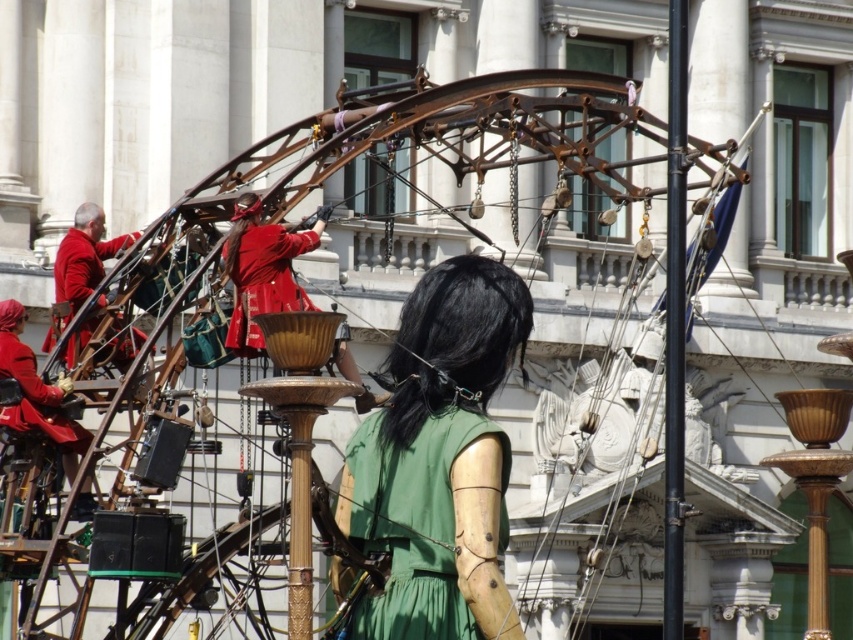
Question: Which of these objects is positioned farthest from the matte red coat at left?

Choices:
 (A) black metal pole at upper right
 (B) green matte dress at center

Answer: (A)

Question: Can you confirm if green matte dress at center is positioned below matte red coat at left?

Choices:
 (A) yes
 (B) no

Answer: (A)

Question: Which object is positioned closest to the green matte dress at center?

Choices:
 (A) black metal pole at upper right
 (B) matte red coat at left

Answer: (A)

Question: Among these objects, which one is farthest from the camera?

Choices:
 (A) matte red coat at left
 (B) black metal pole at upper right

Answer: (A)

Question: Can you confirm if black metal pole at upper right is bigger than matte red coat at left?

Choices:
 (A) no
 (B) yes

Answer: (B)

Question: Can you confirm if green matte dress at center is positioned to the left of black metal pole at upper right?

Choices:
 (A) no
 (B) yes

Answer: (B)